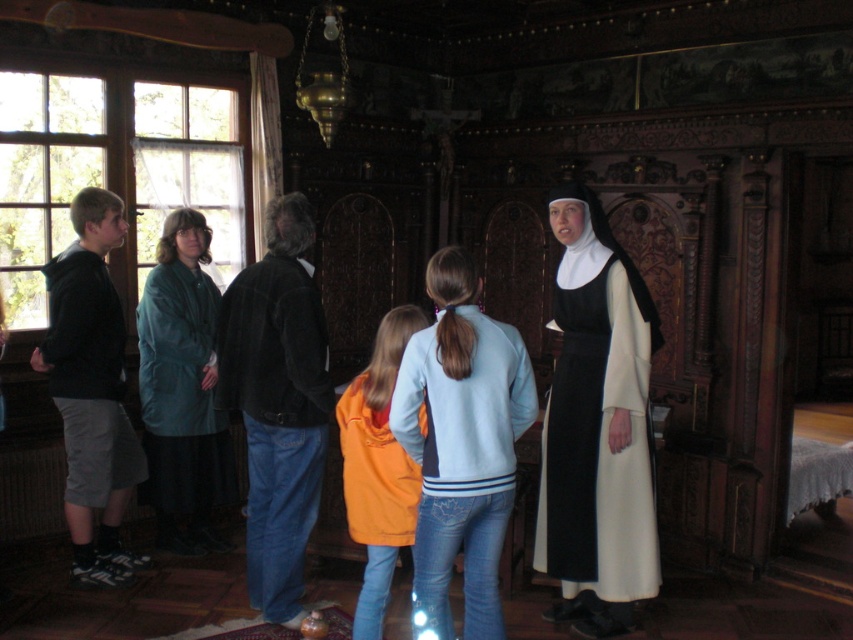
You are standing in the historical setting described. You need to locate the matte black hoodie at left. Where would you look relative to the large windows on the left side of the room?

The matte black hoodie at left is located at coordinates approximately 0.667 along the horizontal axis and 0.701 along the vertical axis relative to the room. Since the large windows are on the left side, the hoodie is positioned to the right of the windows, closer to the center of the room.

You are a photographer setting up for an event in this historical setting. You need to position a wide camera on a tripod between the matte black hoodie at left and the orange fleece jacket at center. Can the camera fit between them without overlapping either clothing item?

The matte black hoodie at left might be wider than orange fleece jacket at center, so there may not be enough space for the camera to fit between them without overlapping. Check the actual width before placing the camera.